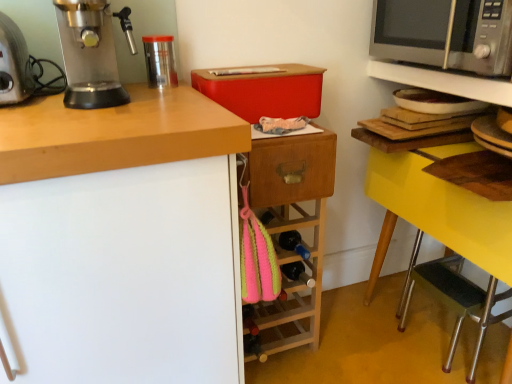
Find the location of `free space below wooden drawer at center (from a real-world perspective)`. free space below wooden drawer at center (from a real-world perspective) is located at coordinates (289, 358).